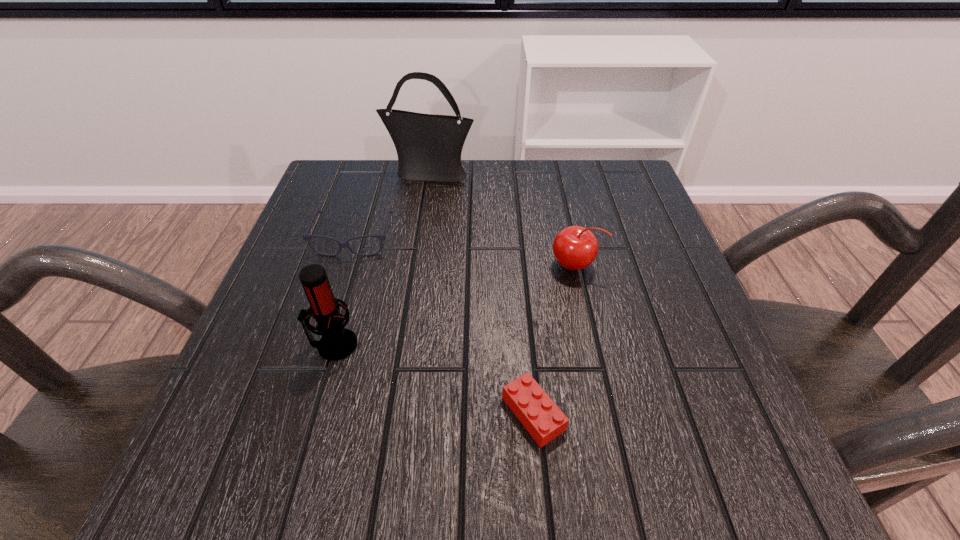
Where is `object positioned at the far left corner`? The height and width of the screenshot is (540, 960). object positioned at the far left corner is located at coordinates (x=429, y=147).

You are a GUI agent. You are given a task and a screenshot of the screen. Output one action in this format:
    pyautogui.click(x=<x>, y=<y>)
    Task: Click on the vacant space at the far edge
    
    Given the screenshot: What is the action you would take?
    pyautogui.click(x=533, y=162)

Locate an element on the screen. blank space at the near edge of the desktop is located at coordinates (481, 447).

Identify the location of free spot at the left edge of the desktop. (256, 373).

Image resolution: width=960 pixels, height=540 pixels. Identify the location of vacant region at the right edge. (611, 261).

In the image, there is a desktop. At what (x,y) coordinates should I click in order to perform the action: click on blank space at the far left corner. Please return your answer as a coordinate pair (x, y). Looking at the image, I should click on (x=371, y=185).

Identify the location of vacant space at the near left corner of the desktop. This screenshot has height=540, width=960. (215, 449).

At what (x,y) coordinates should I click in order to perform the action: click on free space at the far right corner of the desktop. Please return your answer as a coordinate pair (x, y). Looking at the image, I should click on (580, 172).

At what (x,y) coordinates should I click in order to perform the action: click on free point between the shoulder bag and the second nearest object. Please return your answer as a coordinate pair (x, y). This screenshot has height=540, width=960. Looking at the image, I should click on pyautogui.click(x=382, y=259).

Identify the location of vacant point located between the cherry and the nearest object. This screenshot has height=540, width=960. (554, 340).